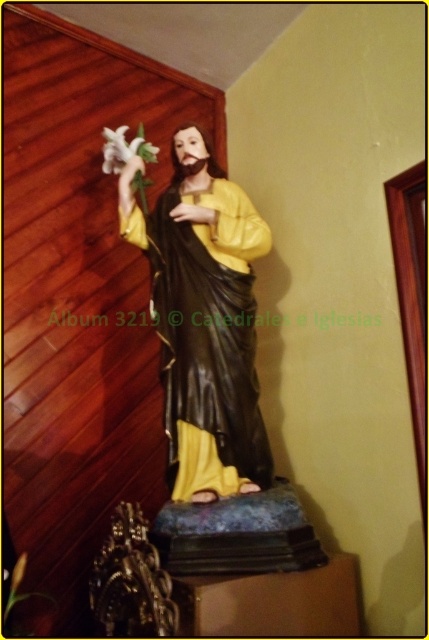
Question: Is matte yellow fabric at center positioned at the back of white matte lily at upper left?

Choices:
 (A) yes
 (B) no

Answer: (B)

Question: Does matte yellow fabric at center have a greater width compared to white matte lily at upper left?

Choices:
 (A) yes
 (B) no

Answer: (A)

Question: Which of the following is the farthest from the observer?

Choices:
 (A) matte yellow fabric at center
 (B) white matte lily at upper left

Answer: (B)

Question: Does matte yellow fabric at center appear over white matte lily at upper left?

Choices:
 (A) yes
 (B) no

Answer: (B)